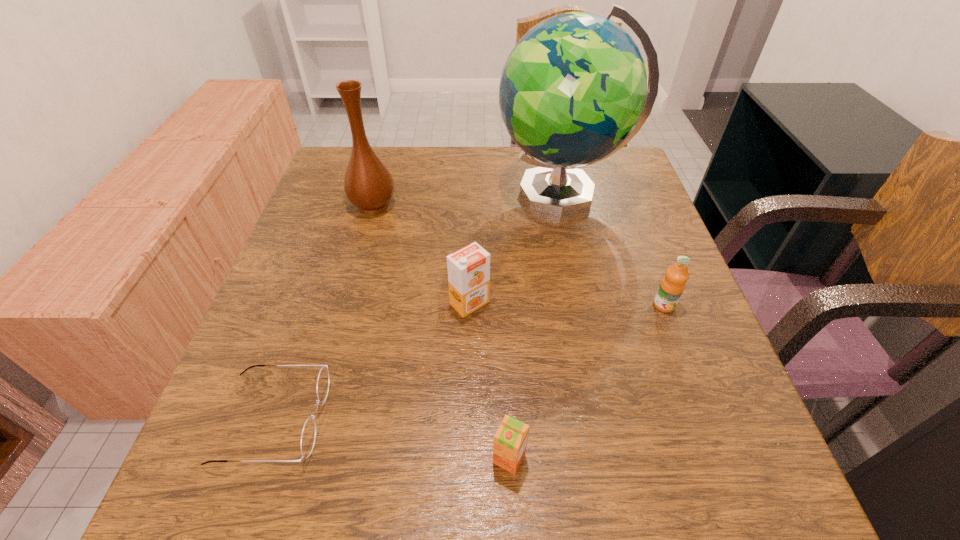
The width and height of the screenshot is (960, 540). I want to click on free location that satisfies the following two spatial constraints: 1. on the front side of the second tallest object; 2. on the front-facing side of the shortest object, so click(314, 419).

This screenshot has width=960, height=540. Identify the location of free space that satisfies the following two spatial constraints: 1. on the front-facing side of the shortest object; 2. on the right side of the nearest orange juice. (260, 458).

You are a GUI agent. You are given a task and a screenshot of the screen. Output one action in this format:
    pyautogui.click(x=<x>, y=<y>)
    Task: Click on the vacant space that satisfies the following two spatial constraints: 1. on the front-facing side of the spectacles; 2. on the left side of the second shortest object
    The height and width of the screenshot is (540, 960).
    Given the screenshot: What is the action you would take?
    pyautogui.click(x=260, y=458)